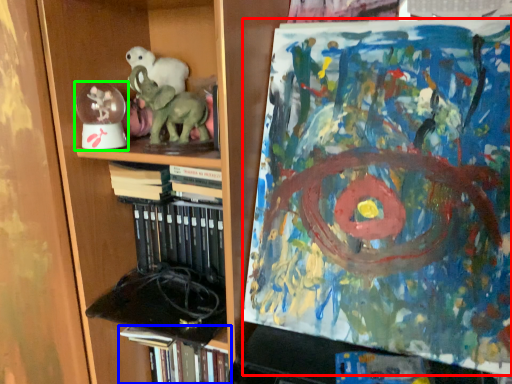
Question: Considering the real-world distances, which object is farthest from art (highlighted by a red box)? book (highlighted by a blue box) or toy (highlighted by a green box)?

Choices:
 (A) book
 (B) toy

Answer: (B)